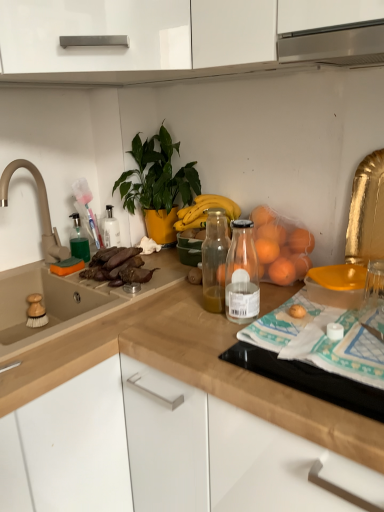
Question: Can you confirm if green translucent soap dispenser at left is bigger than green glossy plant at upper center?

Choices:
 (A) yes
 (B) no

Answer: (B)

Question: Is green translucent soap dispenser at left shorter than green glossy plant at upper center?

Choices:
 (A) no
 (B) yes

Answer: (B)

Question: Is green translucent soap dispenser at left oriented towards green glossy plant at upper center?

Choices:
 (A) no
 (B) yes

Answer: (A)

Question: Considering the relative positions of green translucent soap dispenser at left and green glossy plant at upper center in the image provided, is green translucent soap dispenser at left to the left of green glossy plant at upper center from the viewer's perspective?

Choices:
 (A) yes
 (B) no

Answer: (A)

Question: From the image's perspective, is green translucent soap dispenser at left over green glossy plant at upper center?

Choices:
 (A) no
 (B) yes

Answer: (A)

Question: Which is correct: wooden at upper center, which is counted as the first countertop, starting from the bottom, is inside green glossy plant at upper center, or outside of it?

Choices:
 (A) outside
 (B) inside

Answer: (A)

Question: From the image's perspective, is wooden at upper center, which is counted as the first countertop, starting from the bottom, located above or below green glossy plant at upper center?

Choices:
 (A) below
 (B) above

Answer: (A)

Question: Based on their positions, is wooden at upper center, which is counted as the first countertop, starting from the bottom, located to the left or right of green glossy plant at upper center?

Choices:
 (A) left
 (B) right

Answer: (B)

Question: In terms of size, does wooden at upper center, which is counted as the first countertop, starting from the bottom, appear bigger or smaller than green glossy plant at upper center?

Choices:
 (A) small
 (B) big

Answer: (B)

Question: Considering the positions of point (137, 169) and point (61, 248), is point (137, 169) closer or farther from the camera than point (61, 248)?

Choices:
 (A) farther
 (B) closer

Answer: (B)

Question: Considering the positions of green glossy plant at upper center and beige matte faucet at left in the image, is green glossy plant at upper center taller or shorter than beige matte faucet at left?

Choices:
 (A) tall
 (B) short

Answer: (A)

Question: In terms of width, does green glossy plant at upper center look wider or thinner when compared to beige matte faucet at left?

Choices:
 (A) thin
 (B) wide

Answer: (B)

Question: Would you say green glossy plant at upper center is inside or outside beige matte faucet at left?

Choices:
 (A) outside
 (B) inside

Answer: (A)

Question: Considering the positions of beige matte faucet at left and green glossy plant at upper center in the image, is beige matte faucet at left bigger or smaller than green glossy plant at upper center?

Choices:
 (A) small
 (B) big

Answer: (A)

Question: Is point (3, 200) positioned closer to the camera than point (130, 148)?

Choices:
 (A) closer
 (B) farther

Answer: (A)